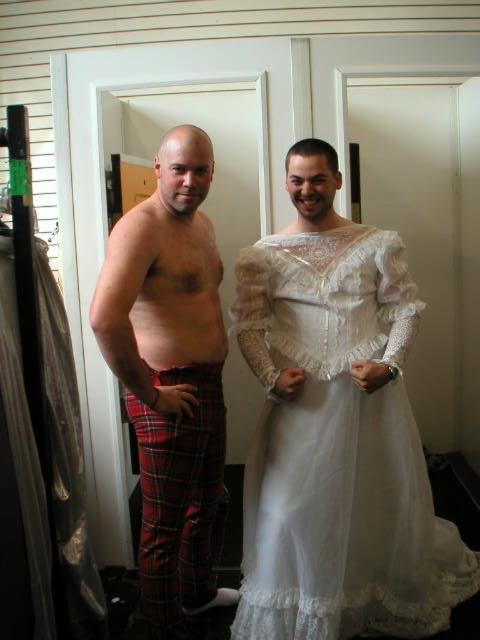
Question: Can you confirm if plaid cotton pants at left is positioned to the left of plaid cotton kilt at lower left?

Choices:
 (A) no
 (B) yes

Answer: (A)

Question: Among these points, which one is farthest from the camera?

Choices:
 (A) (328, 461)
 (B) (163, 506)

Answer: (A)

Question: Estimate the real-world distances between objects in this image. Which object is closer to the plaid cotton pants at left?

Choices:
 (A) red plaid pants at left
 (B) plaid cotton kilt at lower left

Answer: (A)

Question: Does plaid cotton pants at left appear under plaid cotton kilt at lower left?

Choices:
 (A) no
 (B) yes

Answer: (A)

Question: Does red plaid pants at left appear on the left side of plaid cotton kilt at lower left?

Choices:
 (A) yes
 (B) no

Answer: (B)

Question: Which object is farther from the camera taking this photo?

Choices:
 (A) red plaid pants at left
 (B) plaid cotton kilt at lower left
 (C) plaid cotton pants at left

Answer: (B)